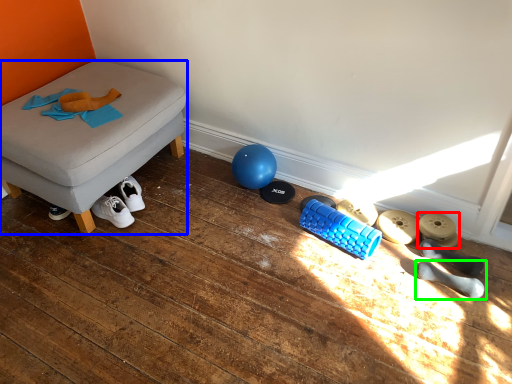
Question: Which object is the farthest from footwear (highlighted by a red box)? Choose among these: furniture (highlighted by a blue box) or footwear (highlighted by a green box).

Choices:
 (A) furniture
 (B) footwear

Answer: (A)